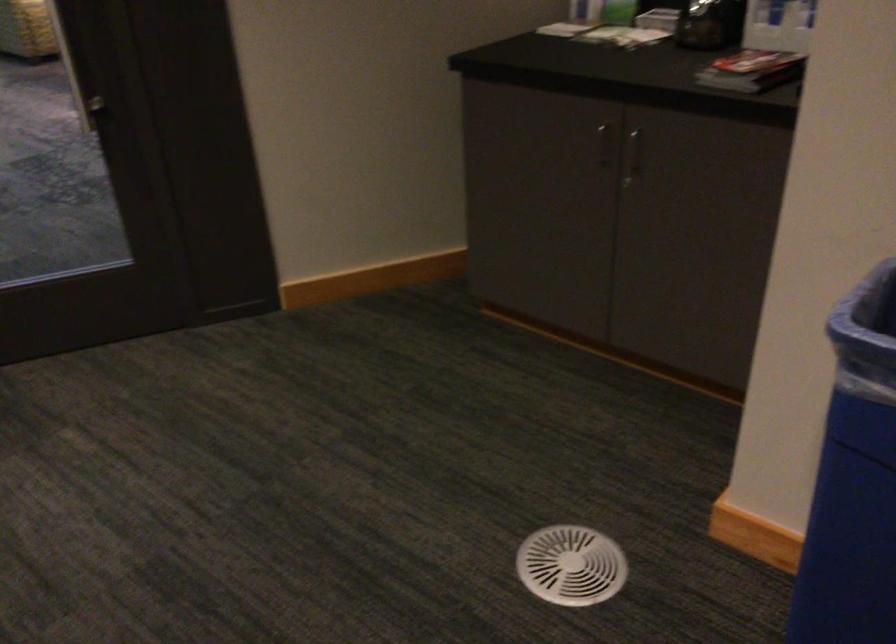
Where would you lift the stack of magazines? Please return your answer as a coordinate pair (x, y).

(751, 71)